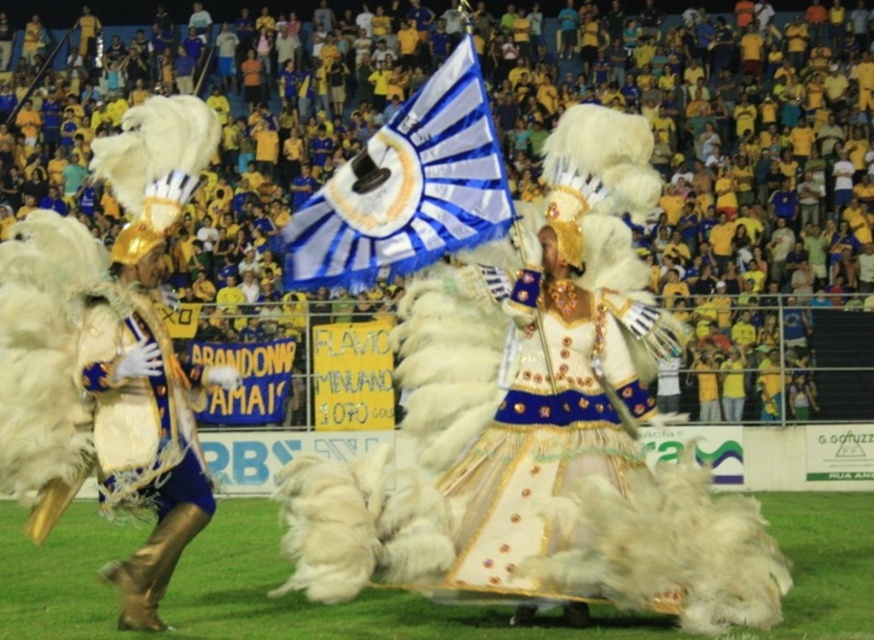
You are a photographer trying to capture the entire scene of the yellow fabric crowd at upper center and the blue and white fabric flag at center in one shot. Considering their widths, which object should you focus on to ensure both are fully visible in your frame?

Since the yellow fabric crowd at upper center is wider than the blue and white fabric flag at center, you should focus on the yellow fabric crowd at upper center to ensure both objects are fully visible in the frame.

You are a photographer trying to capture the blue and white fabric flag at center in your shot. However, the yellow fabric crowd at upper center is blocking your view. Can you adjust your position to see the flag without the crowd obscuring it?

The yellow fabric crowd at upper center is positioned over the blue and white fabric flag at center, so moving your camera angle downward or to the side might allow you to see the flag without the crowd blocking it.